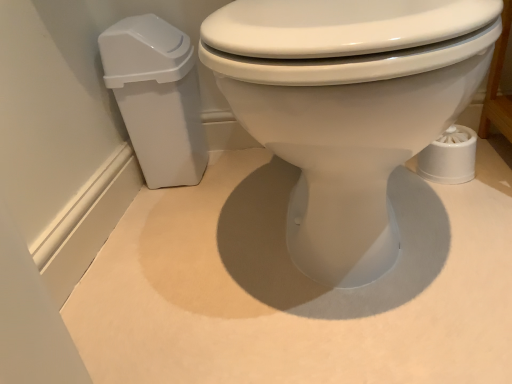
Question: From the image's perspective, is white glossy toilet at center located above or below white plastic trash can at left?

Choices:
 (A) above
 (B) below

Answer: (B)

Question: Relative to white plastic trash can at left, is white glossy toilet at center in front or behind?

Choices:
 (A) front
 (B) behind

Answer: (A)

Question: Is point (275, 52) closer or farther from the camera than point (147, 36)?

Choices:
 (A) farther
 (B) closer

Answer: (B)

Question: Is point (172, 177) closer or farther from the camera than point (472, 11)?

Choices:
 (A) farther
 (B) closer

Answer: (A)

Question: From the image's perspective, relative to white glossy toilet at center, is white plastic trash can at left above or below?

Choices:
 (A) above
 (B) below

Answer: (A)

Question: Is white plastic trash can at left to the left or to the right of white glossy toilet at center in the image?

Choices:
 (A) right
 (B) left

Answer: (B)

Question: Considering the positions of white plastic trash can at left and white glossy toilet at center in the image, is white plastic trash can at left taller or shorter than white glossy toilet at center?

Choices:
 (A) tall
 (B) short

Answer: (B)